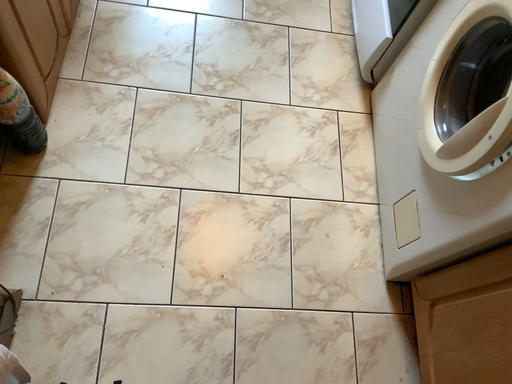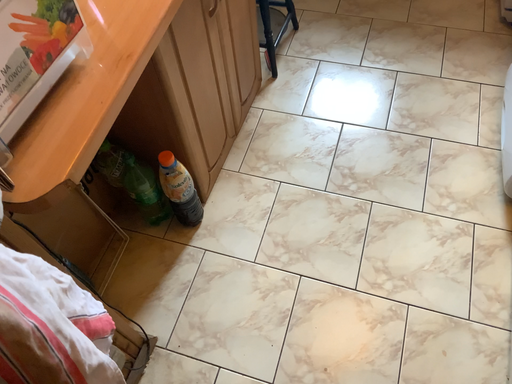
Question: How did the camera likely rotate when shooting the video?

Choices:
 (A) rotated right
 (B) rotated left

Answer: (B)